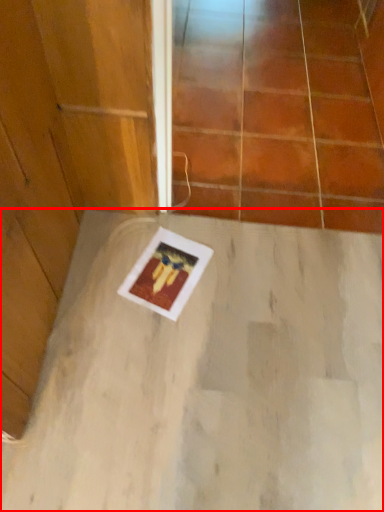
Question: Where is concrete (annotated by the red box) located in relation to glass door in the image?

Choices:
 (A) right
 (B) left

Answer: (B)